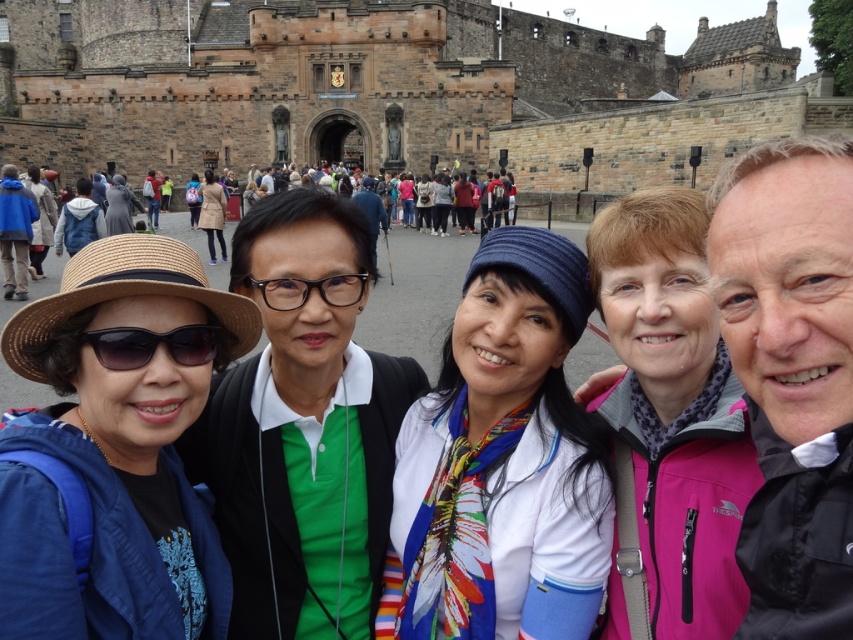
Question: Can you confirm if sunglasses at left is positioned to the right of transparent plastic glasses at center?

Choices:
 (A) yes
 (B) no

Answer: (B)

Question: Among these objects, which one is nearest to the camera?

Choices:
 (A) sunglasses at left
 (B) transparent plastic glasses at center

Answer: (A)

Question: Which point is closer to the camera?

Choices:
 (A) transparent plastic glasses at center
 (B) sunglasses at left

Answer: (B)

Question: Does sunglasses at left appear under transparent plastic glasses at center?

Choices:
 (A) yes
 (B) no

Answer: (A)

Question: Does sunglasses at left have a smaller size compared to transparent plastic glasses at center?

Choices:
 (A) no
 (B) yes

Answer: (B)